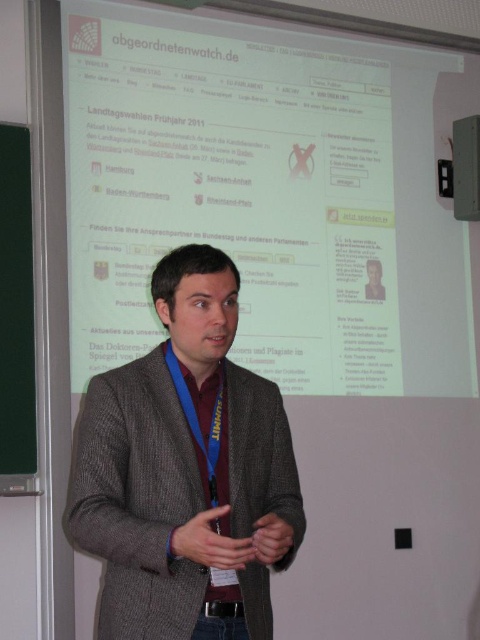
Question: Does white glossy projection screen at upper center lie in front of gray woolen sweater at center?

Choices:
 (A) no
 (B) yes

Answer: (A)

Question: Which of the following is the farthest from the observer?

Choices:
 (A) (391, 371)
 (B) (233, 522)

Answer: (A)

Question: Can you confirm if white glossy projection screen at upper center is positioned above green matte/blackboard at left?

Choices:
 (A) no
 (B) yes

Answer: (B)

Question: Which of the following is the farthest from the observer?

Choices:
 (A) gray woolen sweater at center
 (B) white glossy projection screen at upper center

Answer: (B)

Question: Estimate the real-world distances between objects in this image. Which object is closer to the white glossy projection screen at upper center?

Choices:
 (A) green matte/blackboard at left
 (B) gray woolen sweater at center

Answer: (A)

Question: Is gray woolen sweater at center behind green matte/blackboard at left?

Choices:
 (A) no
 (B) yes

Answer: (A)